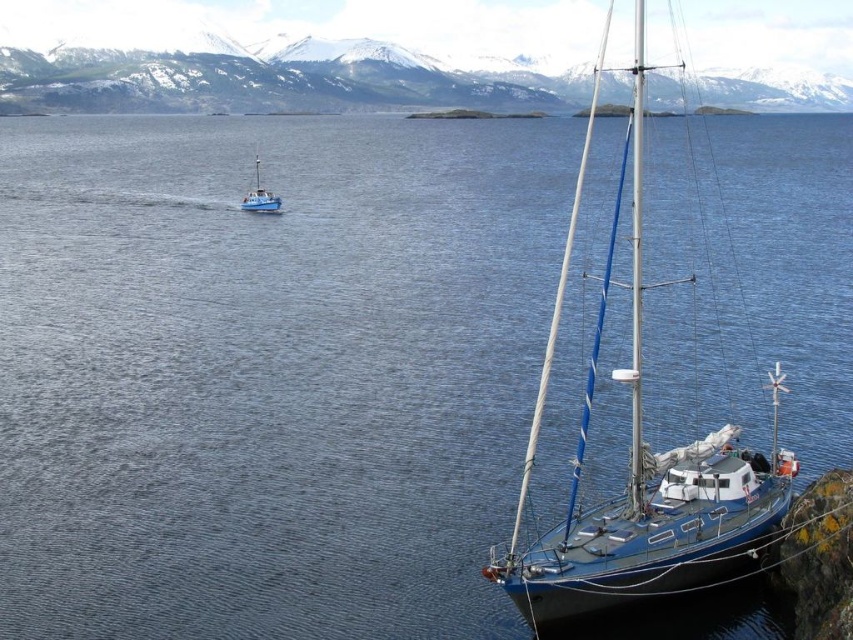
Question: Where is metallic blue sailboat at right located in relation to blue matte boat at upper left in the image?

Choices:
 (A) below
 (B) above

Answer: (B)

Question: Estimate the real-world distances between objects in this image. Which object is closer to the blue matte boat at upper left?

Choices:
 (A) snowy mountain at upper center
 (B) metallic blue sailboat at right

Answer: (B)

Question: From the image, what is the correct spatial relationship of snowy mountain at upper center in relation to blue matte boat at upper left?

Choices:
 (A) left
 (B) right

Answer: (B)

Question: Which point is closer to the camera?

Choices:
 (A) metallic blue sailboat at right
 (B) snowy mountain at upper center

Answer: (A)

Question: Is snowy mountain at upper center positioned before blue matte boat at upper left?

Choices:
 (A) yes
 (B) no

Answer: (B)

Question: Which point is farther from the camera taking this photo?

Choices:
 (A) (669, 552)
 (B) (265, 202)
 (C) (57, 77)

Answer: (C)